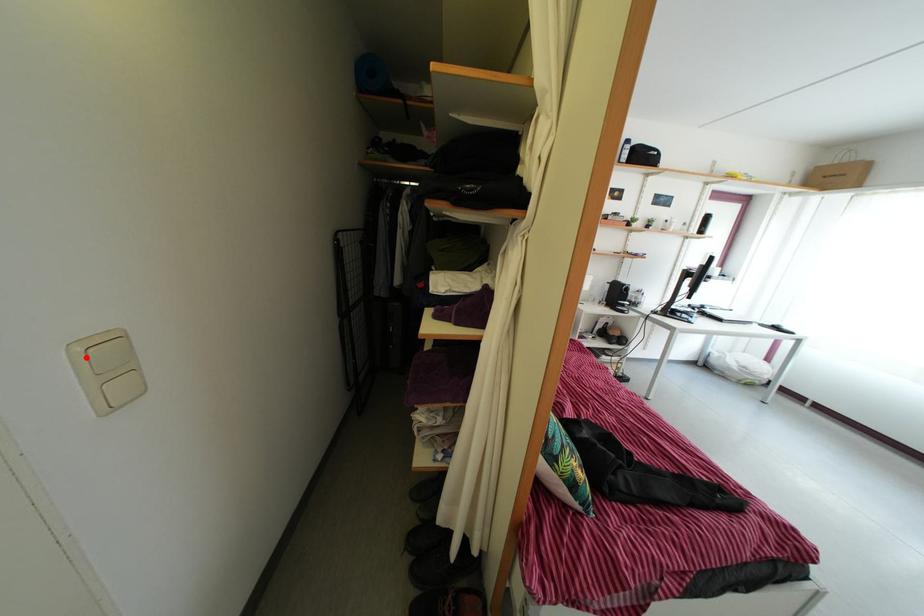
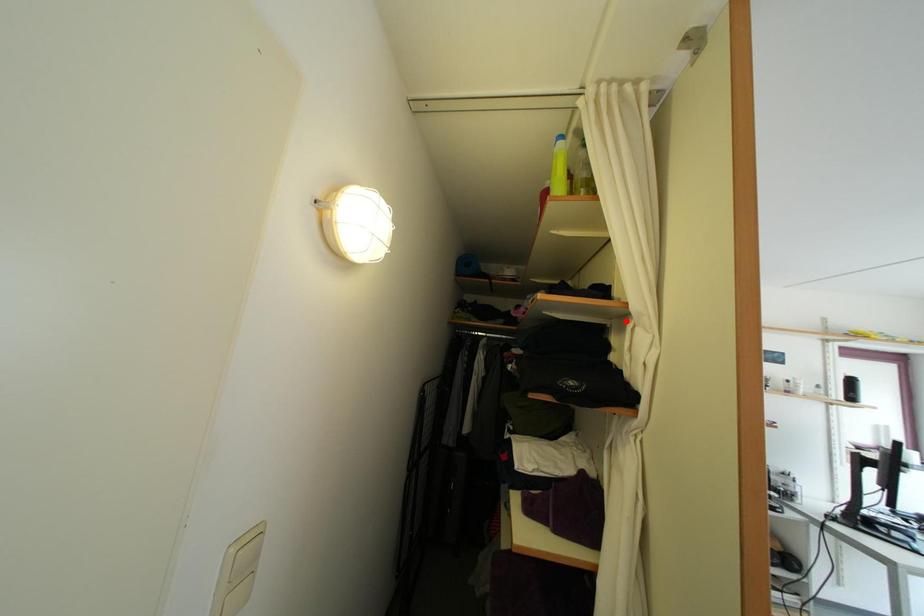
I am providing you with two images of the same scene from different viewpoints. A red point is marked on the first image and another point is marked on the second image. Do the highlighted points in image1 and image2 indicate the same real-world spot?

No